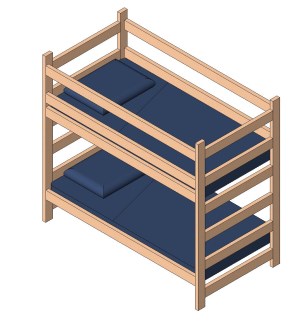
Identify the location of bunkbed. (116, 150).